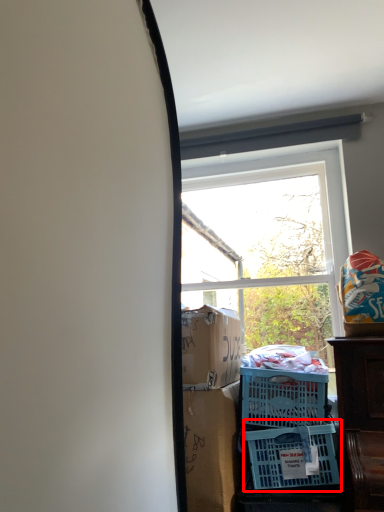
Question: From the image's perspective, what is the correct spatial relationship of basket (annotated by the red box) in relation to window?

Choices:
 (A) below
 (B) above

Answer: (A)